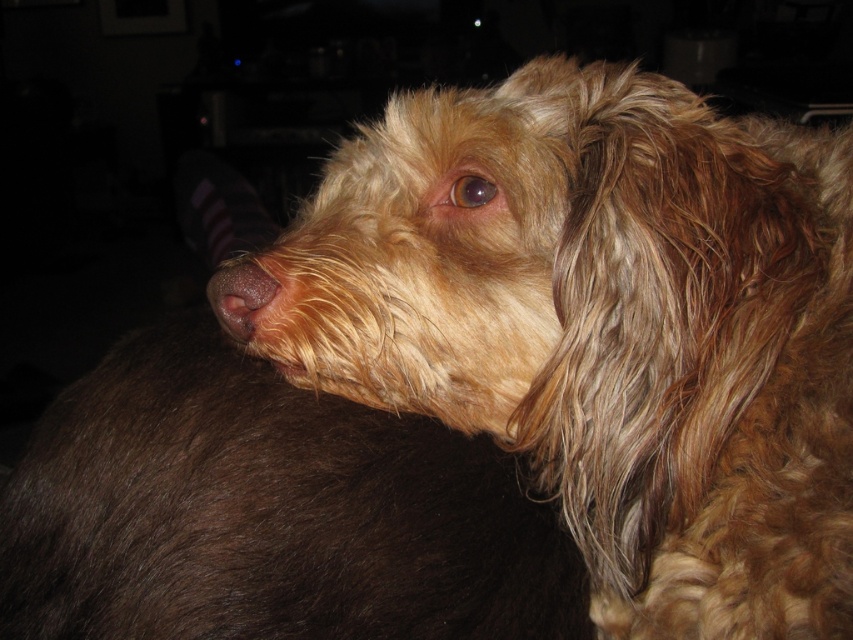
Measure the distance from fuzzy brown dog at center to brown matte nose at center.

The distance of fuzzy brown dog at center from brown matte nose at center is 10.54 inches.

Does fuzzy brown dog at center have a greater width compared to brown matte nose at center?

Yes, fuzzy brown dog at center is wider than brown matte nose at center.

Who is more distant from viewer, (397, 260) or (215, 312)?

Point (215, 312)

Locate an element on the screen. This screenshot has width=853, height=640. fuzzy brown dog at center is located at coordinates coord(608,328).

Is point (570, 340) closer to viewer compared to point (498, 196)?

That is True.

Based on the photo, can you confirm if fuzzy brown dog at center is smaller than brown fur eye at center?

No, fuzzy brown dog at center is not smaller than brown fur eye at center.

The height and width of the screenshot is (640, 853). Find the location of `fuzzy brown dog at center`. fuzzy brown dog at center is located at coordinates (608, 328).

Is point (242, 336) behind point (461, 173)?

No, (242, 336) is in front of (461, 173).

Is brown matte nose at center bigger than brown fur eye at center?

Yes, brown matte nose at center is bigger than brown fur eye at center.

Which is behind, point (209, 300) or point (459, 179)?

Point (209, 300)

The height and width of the screenshot is (640, 853). Find the location of `brown matte nose at center`. brown matte nose at center is located at coordinates (239, 296).